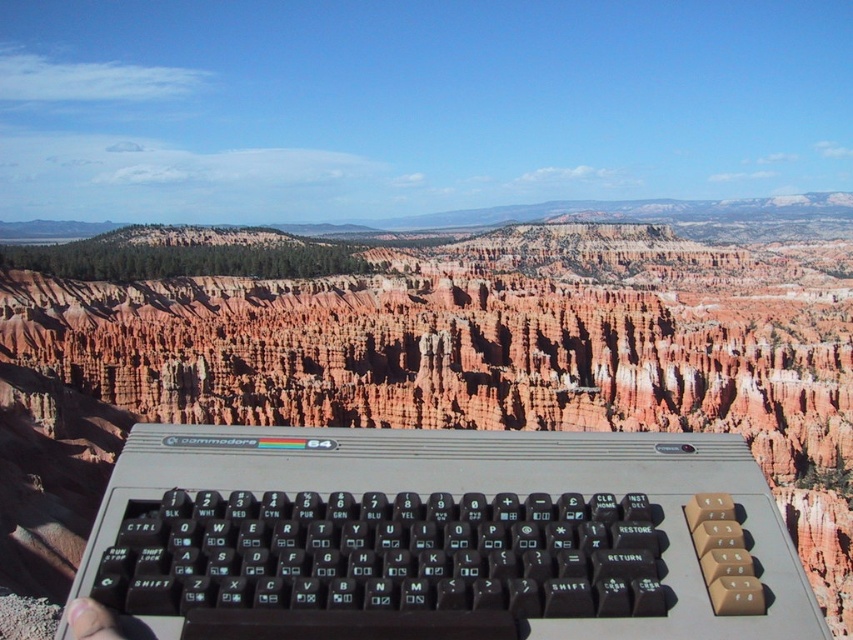
Can you confirm if gray plastic keyboard at center is positioned to the right of skinny flesh at lower left?

Yes, gray plastic keyboard at center is to the right of skinny flesh at lower left.

What are the coordinates of `gray plastic keyboard at center` in the screenshot? It's located at (444, 536).

Who is more forward, (676, 486) or (74, 605)?

Point (74, 605) is in front.

Identify the location of gray plastic keyboard at center. Image resolution: width=853 pixels, height=640 pixels. (444, 536).